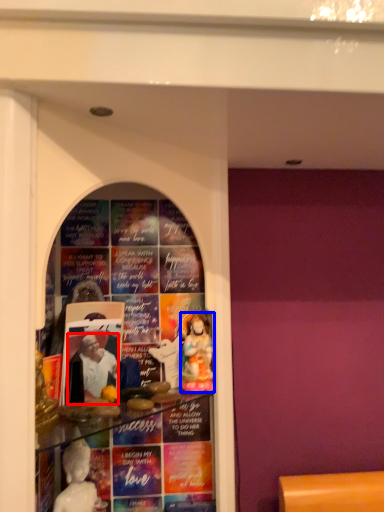
Question: Which point is further to the camera, person (highlighted by a red box) or person (highlighted by a blue box)?

Choices:
 (A) person
 (B) person

Answer: (B)